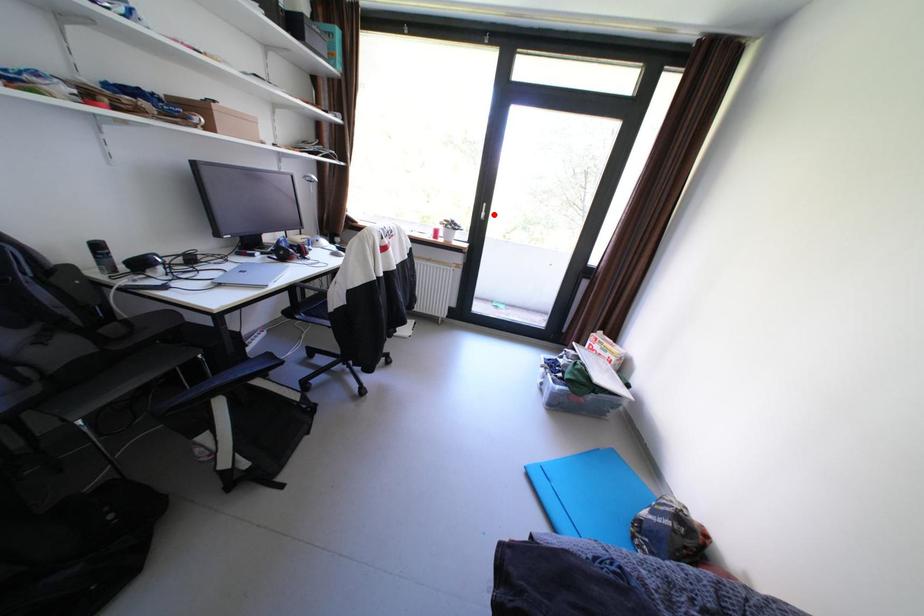
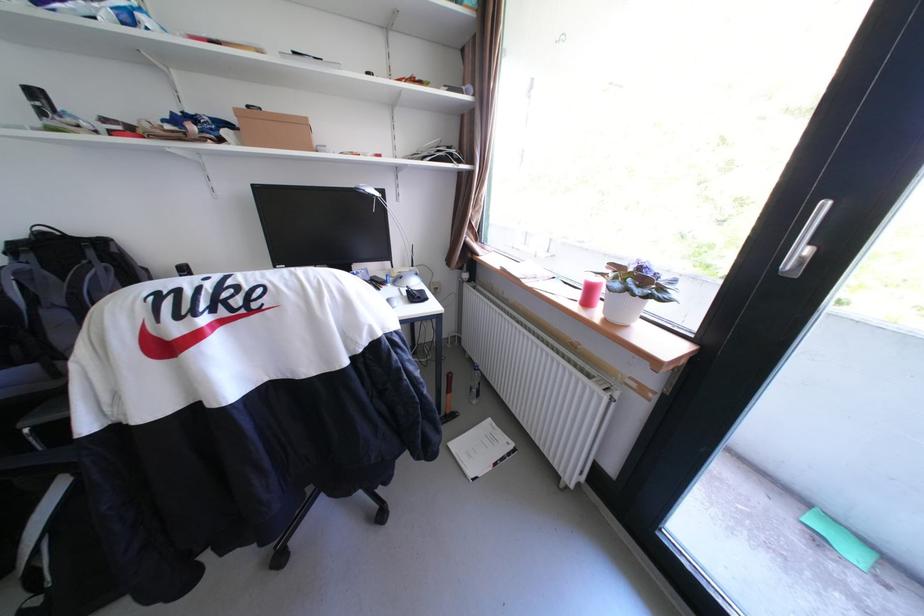
In the second image, find the point that corresponds to the highlighted location in the first image.

(813, 253)